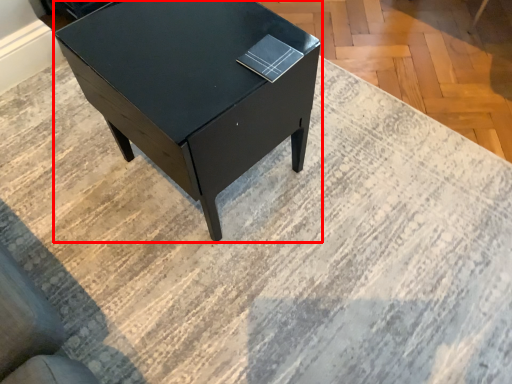
Question: In this image, where is table (annotated by the red box) located relative to book?

Choices:
 (A) left
 (B) right

Answer: (A)